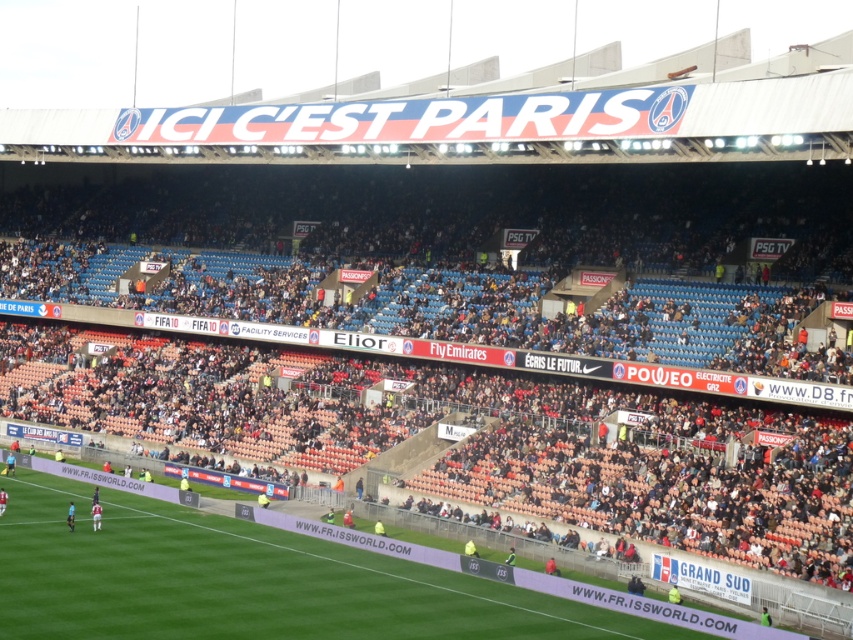
You are a drone operator trying to capture aerial footage of the football stadium. Your drone is currently at a position where the point at coordinates point (102, 426) is visible. If the drone needs to maintain a minimum altitude of 100 meters to avoid interfering with the stadium lights, is the current altitude sufficient?

The distance of point (102, 426) from the camera is 87.68 meters. Since the drone needs to maintain a minimum altitude of 100 meters to avoid the stadium lights, the current altitude of 87.68 meters is insufficient. The drone should ascend to at least 100 meters.

You are a spectator who just arrived at the stadium and want to find your seat. You see the orange plastic seats at center and the green grass football field at center. Which one is closer to you?

The orange plastic seats at center are closer to you because the green grass football field at center is behind them.

You are a drone operator trying to capture a birdseye view of the orange plastic seats at center and the green grass football field at center. Which object is located above the other?

The orange plastic seats at center is positioned over green grass football field at center, so the orange plastic seats at center are above the football field.